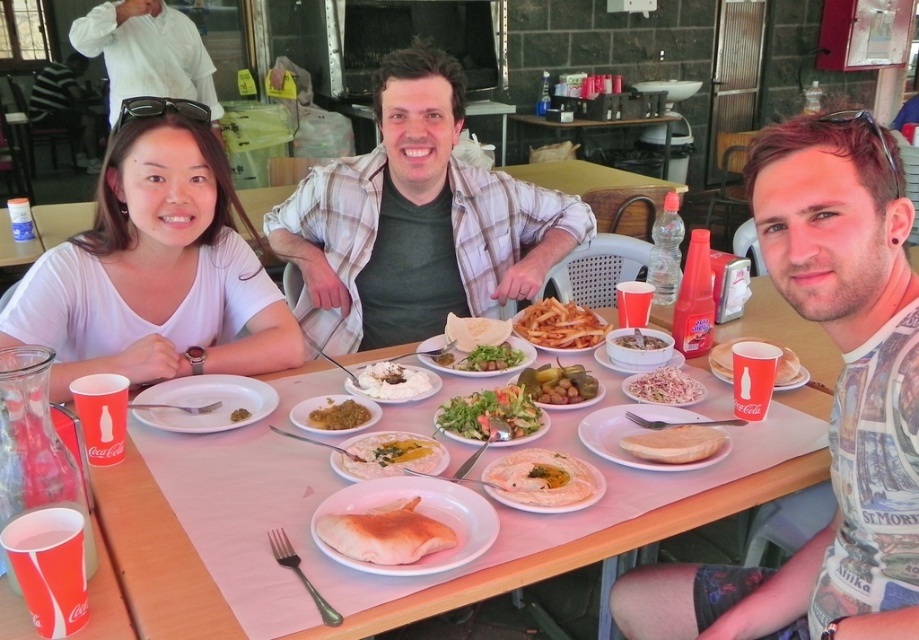
Question: Can you confirm if white matte shirt at upper left is wider than white creamy dessert at center?

Choices:
 (A) yes
 (B) no

Answer: (A)

Question: Based on their relative distances, which object is nearer to the green leafy salad at center?

Choices:
 (A) plaid shirt at center
 (B) slightly browned flatbread at center
 (C) yellow creamy sauce at center
 (D) brown matte curry at center

Answer: (B)

Question: Observing the image, what is the correct spatial positioning of white cotton shirt at upper left in reference to slightly browned flatbread at center?

Choices:
 (A) left
 (B) right

Answer: (A)

Question: Is green glossy olives at center positioned behind white creamy salad at center?

Choices:
 (A) yes
 (B) no

Answer: (B)

Question: Among these objects, which one is nearest to the camera?

Choices:
 (A) yellowish paste at center
 (B) white paper cup at right
 (C) green leafy salad at center
 (D) beige printed t-shirt at center

Answer: (D)

Question: Which object appears closest to the camera in this image?

Choices:
 (A) slightly browned flatbread at center
 (B) beige printed t-shirt at center
 (C) golden crispy fries at center
 (D) white cotton shirt at upper left

Answer: (B)